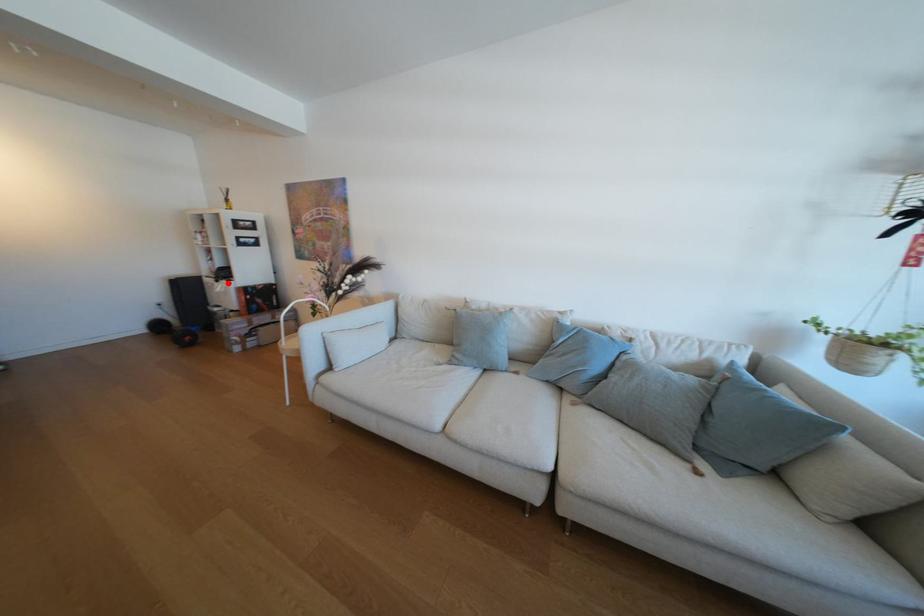
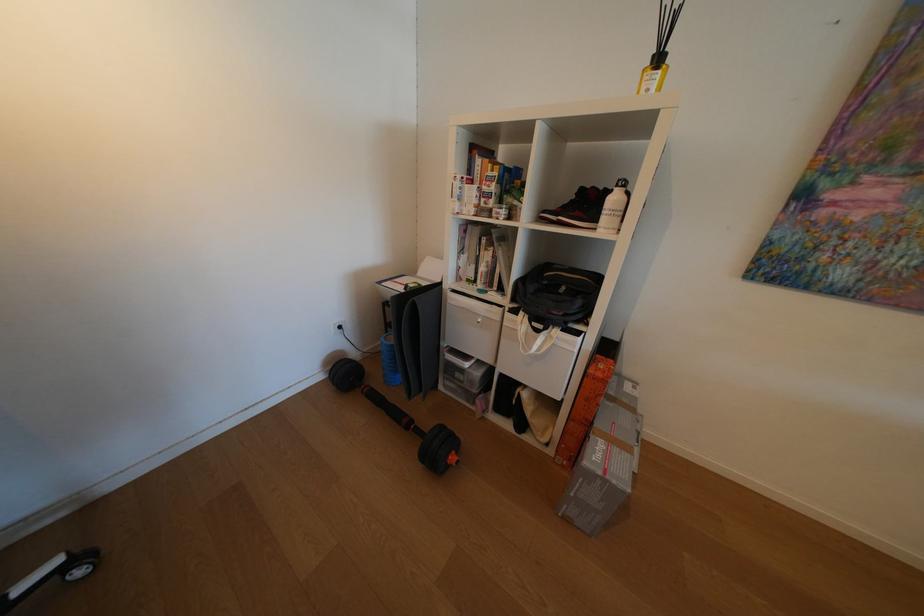
Locate, in the second image, the point that corresponds to the highlighted location in the first image.

(548, 331)